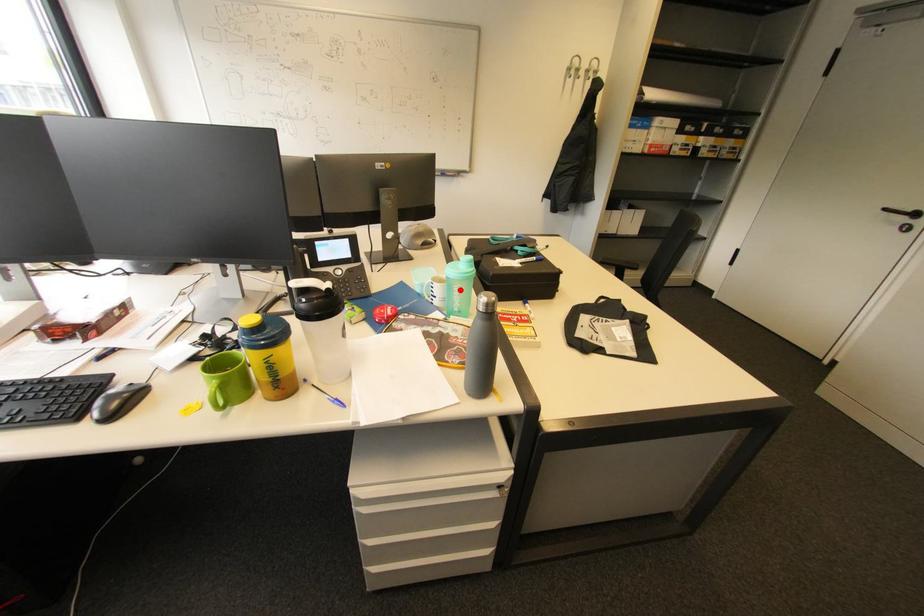
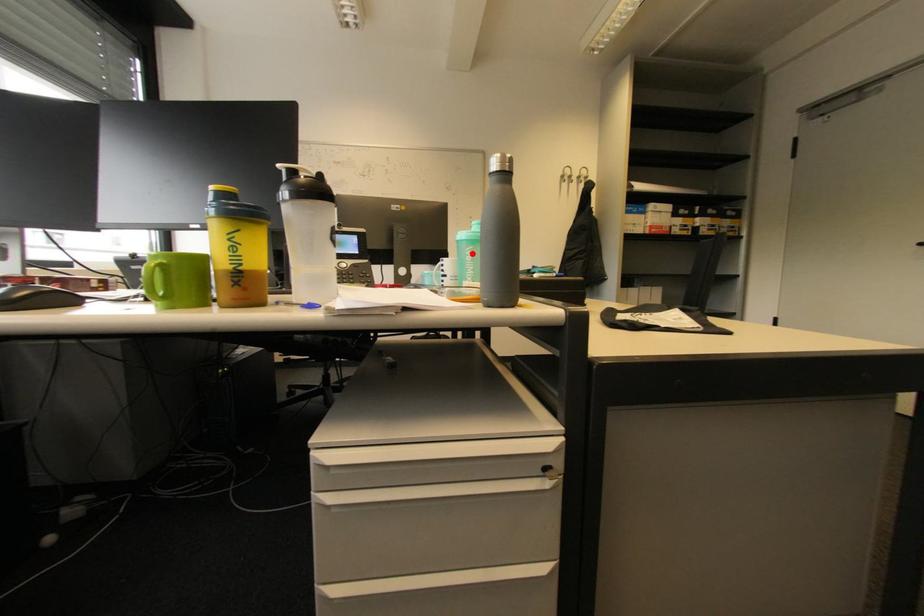
Consider the image. I am providing you with two images of the same scene from different viewpoints. A red point is marked on the first image and another point is marked on the second image. Are the points marked in image1 and image2 representing the same 3D position?

Yes